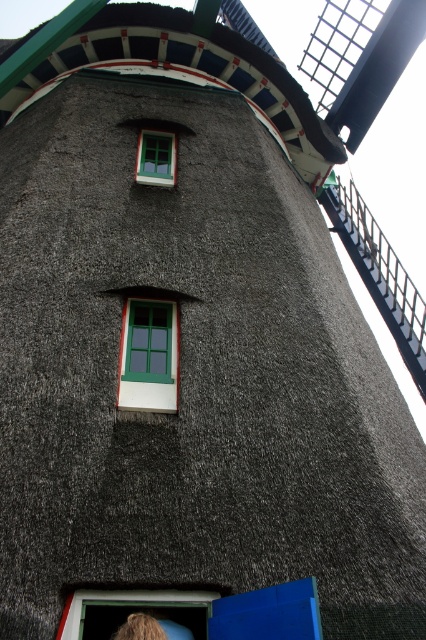
You are standing 25 feet away from the base of the windmill tower. Can you reach the thatched straw roof at upper center with a 6 foot ladder?

The thatched straw roof at upper center is 30.84 feet away from the viewer. Since you are standing 25 feet away from the base, the total distance to the roof would be 25 feet plus the height of the tower. However, a 6 foot ladder is insufficient to reach even if placed at the base, as the roof is much higher than 6 feet.

You are an architect examining the traditional windmill. You notice the thatched straw roof at upper center and the green wooden window at upper center. Which object is located to the right of the other?

The thatched straw roof at upper center is positioned on the right side of green wooden window at upper center.

You are an architect planning to install a new decorative element between the thatched straw roof at upper center and the green wooden window at upper center. Which object has a greater width to accommodate the element?

The thatched straw roof at upper center has a greater width than the green wooden window at upper center, so the decorative element can be placed there.